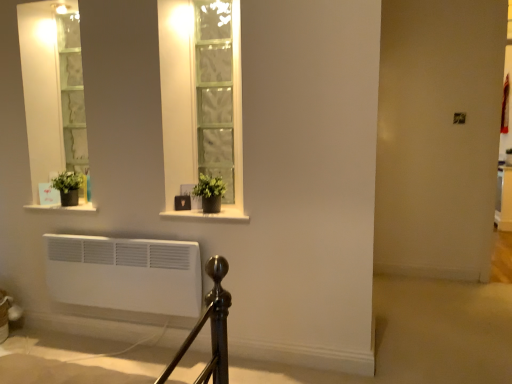
Question: Is matte black pot at lower left, which is the first window sill from left to right, aimed at green matte plant at center, placed as the first houseplant when sorted from front to back?

Choices:
 (A) yes
 (B) no

Answer: (B)

Question: Can you confirm if matte black pot at lower left, placed as the 2th window sill when sorted from right to left, is taller than green matte plant at center, placed as the first houseplant when sorted from front to back?

Choices:
 (A) no
 (B) yes

Answer: (A)

Question: From the image's perspective, is matte black pot at lower left, which is the first window sill from left to right, above green matte plant at center, which is the 2th houseplant in left-to-right order?

Choices:
 (A) yes
 (B) no

Answer: (B)

Question: Considering the relative positions of matte black pot at lower left, which is the first window sill from left to right, and green matte plant at center, which is counted as the 1th houseplant, starting from the right, in the image provided, is matte black pot at lower left, which is the first window sill from left to right, behind green matte plant at center, which is counted as the 1th houseplant, starting from the right,?

Choices:
 (A) yes
 (B) no

Answer: (A)

Question: Would you say matte black pot at lower left, placed as the 2th window sill when sorted from right to left, is outside green matte plant at center, which is counted as the 1th houseplant, starting from the right?

Choices:
 (A) yes
 (B) no

Answer: (A)

Question: From a real-world perspective, relative to matte black pot at lower left, placed as the 2th window sill when sorted from right to left, is green matte plant at left, the first houseplant in the back-to-front sequence, vertically above or below?

Choices:
 (A) above
 (B) below

Answer: (A)

Question: Is green matte plant at left, which appears as the 2th houseplant when viewed from the right, spatially inside matte black pot at lower left, which is the first window sill from left to right, or outside of it?

Choices:
 (A) inside
 (B) outside

Answer: (B)

Question: From their relative heights in the image, would you say green matte plant at left, the first houseplant in the back-to-front sequence, is taller or shorter than matte black pot at lower left, which is the first window sill from left to right?

Choices:
 (A) tall
 (B) short

Answer: (A)

Question: In terms of size, does green matte plant at left, which appears as the 2th houseplant when viewed from the right, appear bigger or smaller than matte black pot at lower left, placed as the 2th window sill when sorted from right to left?

Choices:
 (A) big
 (B) small

Answer: (B)

Question: Is green matte plant at left, which appears as the 1th houseplant when viewed from the left, taller or shorter than green matte plant at center, which is the 2th houseplant in left-to-right order?

Choices:
 (A) tall
 (B) short

Answer: (B)

Question: From the image's perspective, is green matte plant at left, which appears as the 1th houseplant when viewed from the left, located above or below green matte plant at center, placed as the first houseplant when sorted from front to back?

Choices:
 (A) above
 (B) below

Answer: (A)

Question: Is green matte plant at left, which appears as the 2th houseplant when viewed from the right, situated inside green matte plant at center, which is counted as the 1th houseplant, starting from the right, or outside?

Choices:
 (A) inside
 (B) outside

Answer: (B)

Question: Considering the positions of green matte plant at left, which appears as the 1th houseplant when viewed from the left, and green matte plant at center, placed as the first houseplant when sorted from front to back, in the image, is green matte plant at left, which appears as the 1th houseplant when viewed from the left, bigger or smaller than green matte plant at center, placed as the first houseplant when sorted from front to back,?

Choices:
 (A) small
 (B) big

Answer: (A)

Question: Looking at the image, does matte black pot at lower left, which is the first window sill from left to right, seem bigger or smaller compared to green matte plant at left, which appears as the 1th houseplant when viewed from the left?

Choices:
 (A) big
 (B) small

Answer: (A)

Question: From the image's perspective, is matte black pot at lower left, which is the first window sill from left to right, located above or below green matte plant at left, the first houseplant in the back-to-front sequence?

Choices:
 (A) below
 (B) above

Answer: (A)